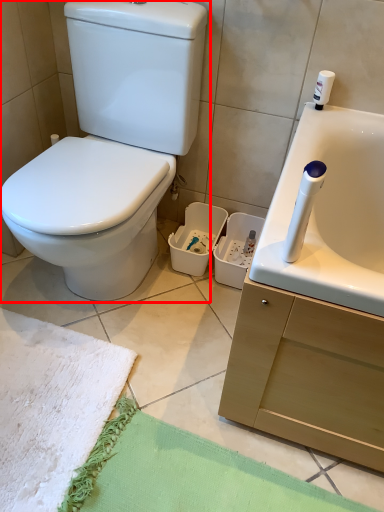
Question: Where is toilet (annotated by the red box) located in relation to beach towel in the image?

Choices:
 (A) right
 (B) left

Answer: (A)